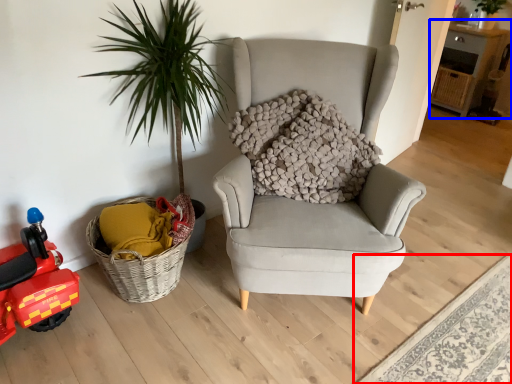
Question: Which object is further to the camera taking this photo, plain (highlighted by a red box) or table (highlighted by a blue box)?

Choices:
 (A) plain
 (B) table

Answer: (B)